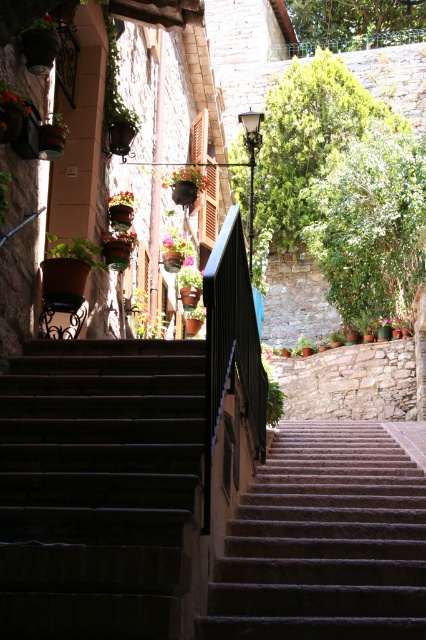
Question: Can you confirm if brown stone stairs at lower left is thinner than matte black pot at upper left?

Choices:
 (A) yes
 (B) no

Answer: (B)

Question: Can you confirm if matte green pot at center is smaller than matte brown pot at upper left?

Choices:
 (A) yes
 (B) no

Answer: (A)

Question: Is matte green pot at center behind matte brown pot at upper left?

Choices:
 (A) yes
 (B) no

Answer: (A)

Question: Estimate the real-world distances between objects in this image. Which object is farther from the granite stairs at center?

Choices:
 (A) green matte plant at left
 (B) green leafy plant at upper center
 (C) matte orange flower pot at center

Answer: (C)

Question: Which object appears farthest from the camera in this image?

Choices:
 (A) matte orange flower pot at center
 (B) matte brown pot at upper left

Answer: (A)

Question: Which object appears farthest from the camera in this image?

Choices:
 (A) granite stairs at center
 (B) matte green pot at center

Answer: (B)